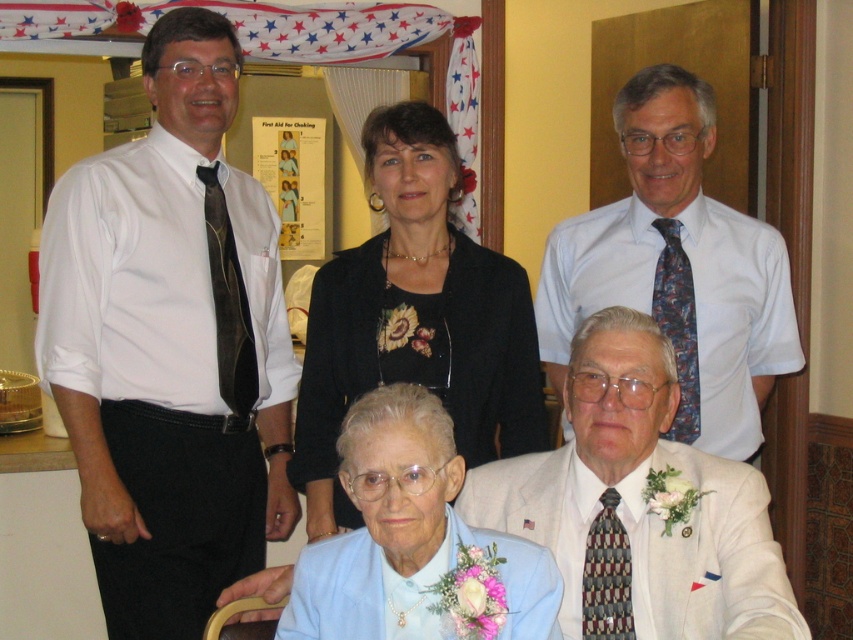
You are a photographer adjusting your camera settings to focus on the white textured suit at lower right and the blue patterned tie at right. Which of these two items should you focus on first to ensure clarity in your photo?

The white textured suit at lower right is closer to the viewer than the blue patterned tie at right, so you should focus on the white textured suit at lower right first to ensure clarity.

You are at a formal event and need to take a photo of the white textured suit at lower right and the brown textured tie at left. Which one is closer to the camera?

The white textured suit at lower right is closer to the camera because it is in front of the brown textured tie at left.